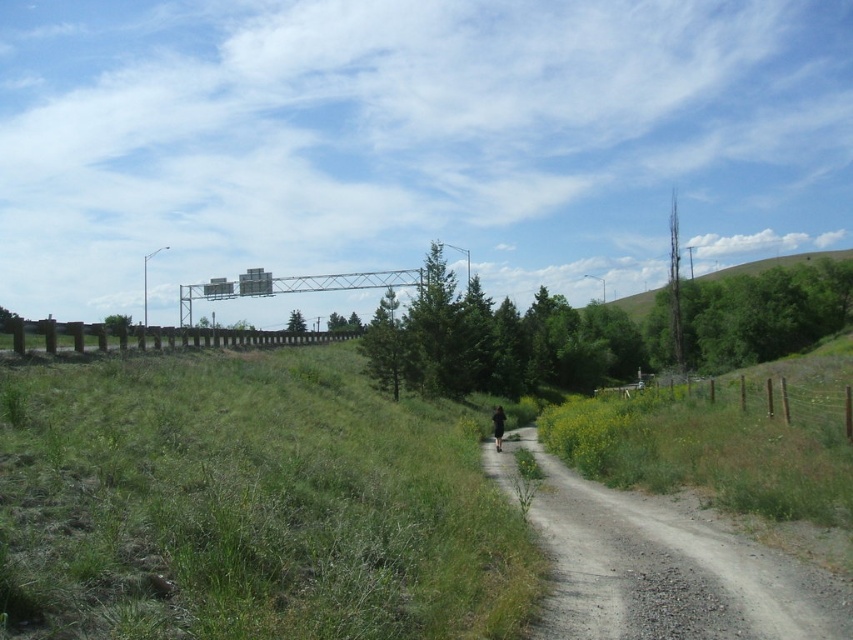
You are a cyclist planning to ride along the gray gravel path at center and the brown wooden fence at left. Which object should you stay closer to for safety?

You should stay closer to the brown wooden fence at left because the gray gravel path at center is positioned on the right side of it, keeping you away from the highway overpass in the background.